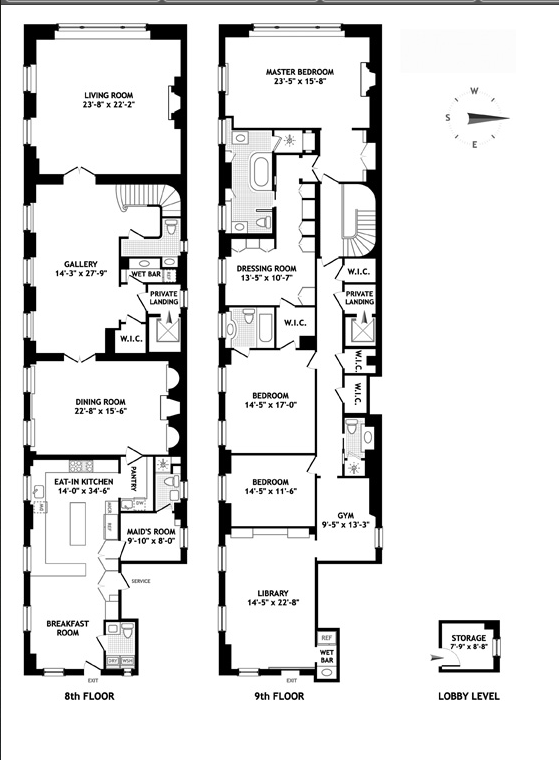
The height and width of the screenshot is (760, 559). I want to click on tub, so click(265, 166), click(265, 325).